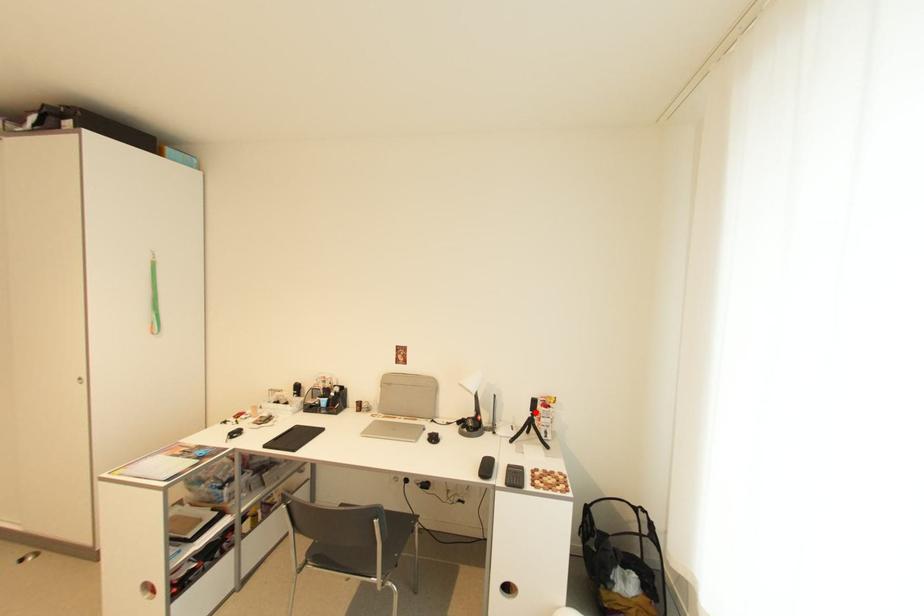
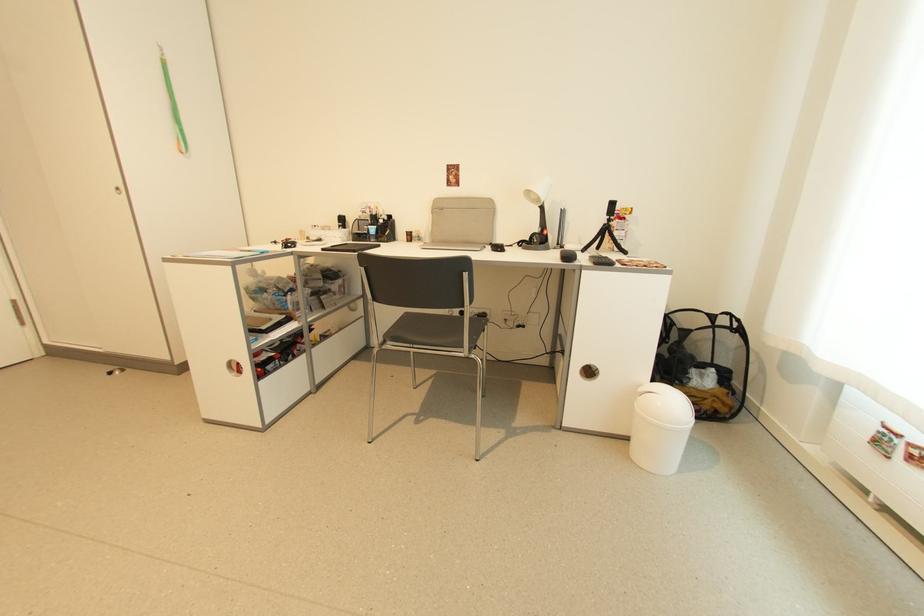
Question: I am providing you with two images of the same scene from different viewpoints. Image1 has a red point marked. In image2, the corresponding 3D location appears at what relative position? Reply with the corresponding letter.

Choices:
 (A) Closer
 (B) Farther

Answer: (A)